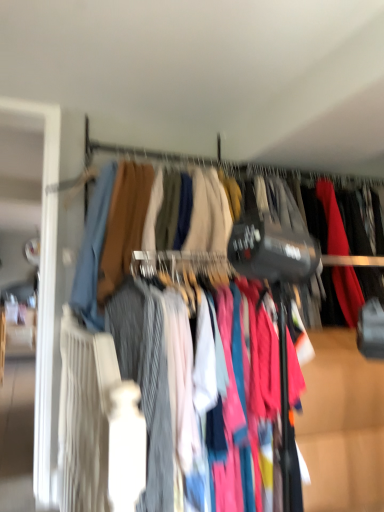
Question: Is striped cotton pants at center inside matte fabric dress at center?

Choices:
 (A) no
 (B) yes

Answer: (B)

Question: Does matte fabric dress at center have a larger size compared to striped cotton pants at center?

Choices:
 (A) yes
 (B) no

Answer: (B)

Question: Can you confirm if matte fabric dress at center is shorter than striped cotton pants at center?

Choices:
 (A) yes
 (B) no

Answer: (A)

Question: Is matte fabric dress at center wider than striped cotton pants at center?

Choices:
 (A) yes
 (B) no

Answer: (A)

Question: From the image's perspective, is matte fabric dress at center on top of striped cotton pants at center?

Choices:
 (A) no
 (B) yes

Answer: (B)

Question: Is matte fabric dress at center facing away from striped cotton pants at center?

Choices:
 (A) yes
 (B) no

Answer: (A)

Question: From the image's perspective, is textured fabric clothes at center beneath matte fabric clothesline at upper center?

Choices:
 (A) yes
 (B) no

Answer: (A)

Question: Does textured fabric clothes at center have a lesser width compared to matte fabric clothesline at upper center?

Choices:
 (A) no
 (B) yes

Answer: (A)

Question: Does textured fabric clothes at center have a greater height compared to matte fabric clothesline at upper center?

Choices:
 (A) yes
 (B) no

Answer: (A)

Question: Considering the relative sizes of textured fabric clothes at center and matte fabric clothesline at upper center in the image provided, is textured fabric clothes at center shorter than matte fabric clothesline at upper center?

Choices:
 (A) yes
 (B) no

Answer: (B)

Question: Is matte fabric clothesline at upper center inside textured fabric clothes at center?

Choices:
 (A) no
 (B) yes

Answer: (A)

Question: Is textured fabric clothes at center facing away from matte fabric clothesline at upper center?

Choices:
 (A) yes
 (B) no

Answer: (B)

Question: Can you confirm if striped cotton pants at center is smaller than matte fabric dress at center?

Choices:
 (A) no
 (B) yes

Answer: (A)